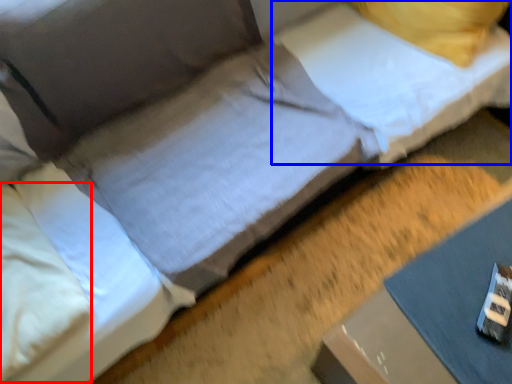
Question: Which point is closer to the camera, pillow (highlighted by a red box) or pillow (highlighted by a blue box)?

Choices:
 (A) pillow
 (B) pillow

Answer: (A)